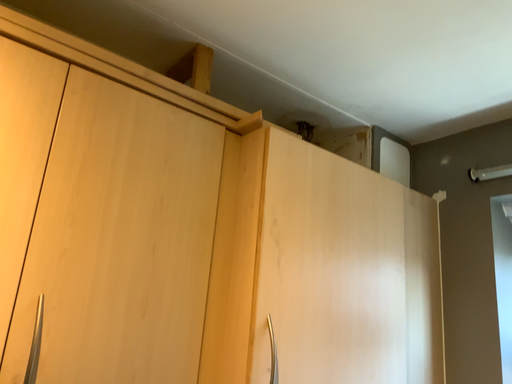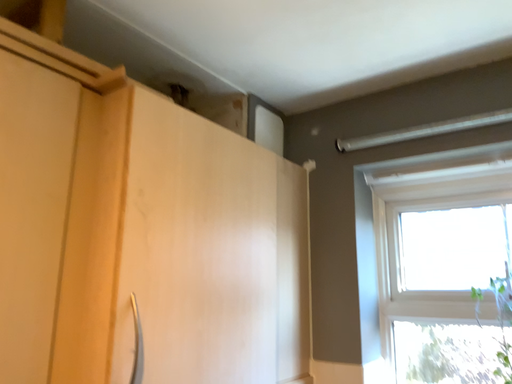
Question: How did the camera likely rotate when shooting the video?

Choices:
 (A) rotated left
 (B) rotated right

Answer: (B)